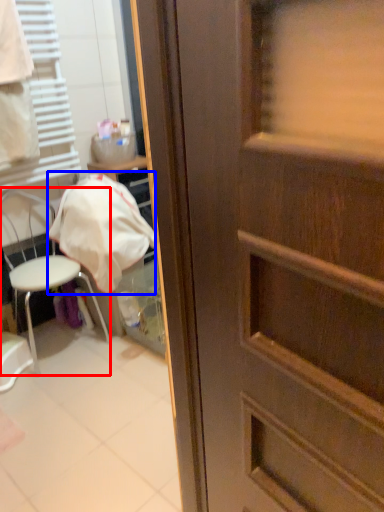
Question: Which object is closer to the camera taking this photo, chair (highlighted by a red box) or blanket (highlighted by a blue box)?

Choices:
 (A) chair
 (B) blanket

Answer: (A)